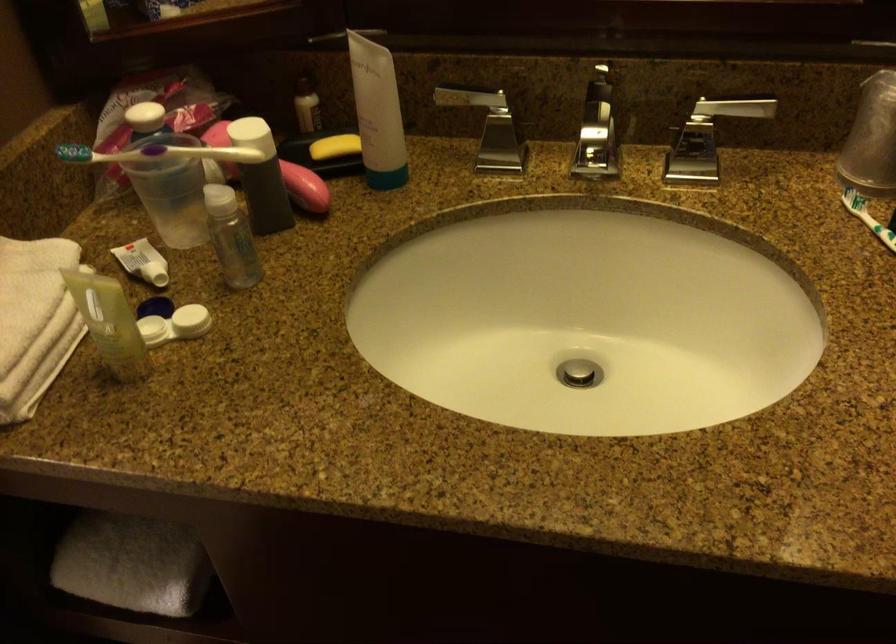
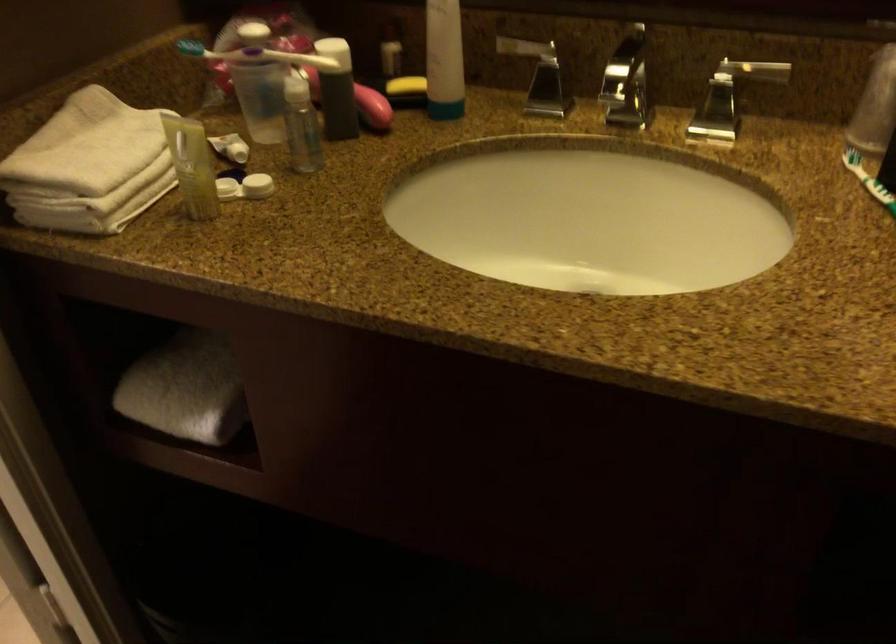
The point at (138,556) is marked in the first image. Where is the corresponding point in the second image?

(185, 389)